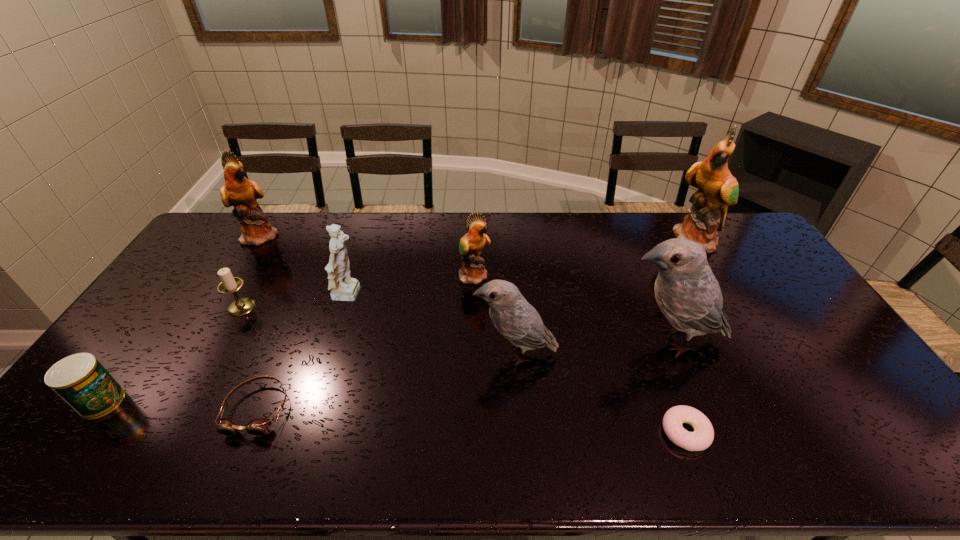
Where is `the third shortest object`? the third shortest object is located at coordinates (80, 380).

Identify the location of can. (80, 380).

You are a GUI agent. You are given a task and a screenshot of the screen. Output one action in this format:
    pyautogui.click(x=<x>, y=<y>)
    Task: Click on the ninth tallest object
    
    Given the screenshot: What is the action you would take?
    pyautogui.click(x=258, y=427)

This screenshot has width=960, height=540. What are the coordinates of `goggles` in the screenshot? It's located at (258, 427).

In order to click on pink doughnut in this screenshot , I will do `click(702, 437)`.

Find the location of a particular element. The width and height of the screenshot is (960, 540). the shortest object is located at coordinates (702, 437).

The width and height of the screenshot is (960, 540). Identify the location of free space located on the front-facing side of the tallest parrot. (713, 267).

Where is `free location located 0.260m on the front-facing side of the second smallest green parrot`? Image resolution: width=960 pixels, height=540 pixels. free location located 0.260m on the front-facing side of the second smallest green parrot is located at coordinates (349, 235).

This screenshot has width=960, height=540. What are the coordinates of `free region located on the front-facing side of the right gray parrot` in the screenshot? It's located at (571, 341).

Where is `vacant position located on the front-facing side of the right gray parrot`? Image resolution: width=960 pixels, height=540 pixels. vacant position located on the front-facing side of the right gray parrot is located at coordinates (582, 341).